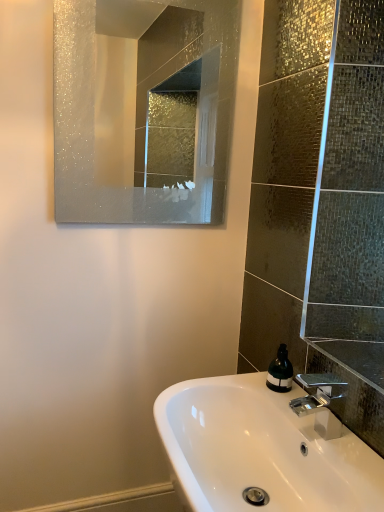
Question: From the image's perspective, would you say white glossy sink at lower center is positioned over frosted glass mirror at upper center?

Choices:
 (A) yes
 (B) no

Answer: (B)

Question: From the image's perspective, would you say white glossy sink at lower center is shown under frosted glass mirror at upper center?

Choices:
 (A) yes
 (B) no

Answer: (A)

Question: Is white glossy sink at lower center smaller than frosted glass mirror at upper center?

Choices:
 (A) no
 (B) yes

Answer: (A)

Question: Does white glossy sink at lower center have a lesser width compared to frosted glass mirror at upper center?

Choices:
 (A) yes
 (B) no

Answer: (B)

Question: Can you confirm if white glossy sink at lower center is positioned to the left of frosted glass mirror at upper center?

Choices:
 (A) no
 (B) yes

Answer: (A)

Question: Would you say polished chrome faucet at lower right is to the left or to the right of frosted glass mirror at upper center in the picture?

Choices:
 (A) right
 (B) left

Answer: (A)

Question: Is polished chrome faucet at lower right spatially inside frosted glass mirror at upper center, or outside of it?

Choices:
 (A) outside
 (B) inside

Answer: (A)

Question: Based on their sizes in the image, would you say polished chrome faucet at lower right is bigger or smaller than frosted glass mirror at upper center?

Choices:
 (A) small
 (B) big

Answer: (A)

Question: Looking at their shapes, would you say polished chrome faucet at lower right is wider or thinner than frosted glass mirror at upper center?

Choices:
 (A) wide
 (B) thin

Answer: (A)

Question: From their relative heights in the image, would you say green matte soap dispenser at lower right is taller or shorter than polished chrome faucet at lower right?

Choices:
 (A) short
 (B) tall

Answer: (A)

Question: Considering their positions, is green matte soap dispenser at lower right located in front of or behind polished chrome faucet at lower right?

Choices:
 (A) behind
 (B) front

Answer: (A)

Question: Considering the positions of point (271, 375) and point (314, 385), is point (271, 375) closer or farther from the camera than point (314, 385)?

Choices:
 (A) farther
 (B) closer

Answer: (A)

Question: Is green matte soap dispenser at lower right inside the boundaries of polished chrome faucet at lower right, or outside?

Choices:
 (A) inside
 (B) outside

Answer: (B)

Question: From the image's perspective, is frosted glass mirror at upper center located above or below polished chrome faucet at lower right?

Choices:
 (A) above
 (B) below

Answer: (A)

Question: Is frosted glass mirror at upper center inside the boundaries of polished chrome faucet at lower right, or outside?

Choices:
 (A) outside
 (B) inside

Answer: (A)